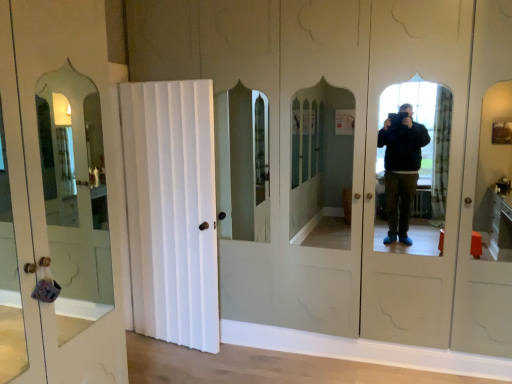
Question: From the image's perspective, is white wooden door at left, positioned as the 2th door in right-to-left order, above or below white wood door at center, which is the second door from left to right?

Choices:
 (A) above
 (B) below

Answer: (A)

Question: Choose the correct answer: Is white wooden door at left, positioned as the 2th door in right-to-left order, inside white wood door at center, which is the second door from left to right, or outside it?

Choices:
 (A) outside
 (B) inside

Answer: (A)

Question: From a real-world perspective, relative to white wood door at center, positioned as the 1th door in right-to-left order, is white wooden door at left, the 1th door from the left, vertically above or below?

Choices:
 (A) above
 (B) below

Answer: (A)

Question: In terms of width, does white wood door at center, which is the second door from left to right, look wider or thinner when compared to white wooden door at left, positioned as the 2th door in right-to-left order?

Choices:
 (A) thin
 (B) wide

Answer: (B)

Question: Does point (124, 137) appear closer or farther from the camera than point (103, 349)?

Choices:
 (A) farther
 (B) closer

Answer: (A)

Question: Based on their positions, is white wood door at center, which is the second door from left to right, located to the left or right of white wooden door at left, positioned as the 2th door in right-to-left order?

Choices:
 (A) left
 (B) right

Answer: (B)

Question: From the image's perspective, is white wood door at center, which is the second door from left to right, located above or below white wooden door at left, positioned as the 2th door in right-to-left order?

Choices:
 (A) above
 (B) below

Answer: (B)